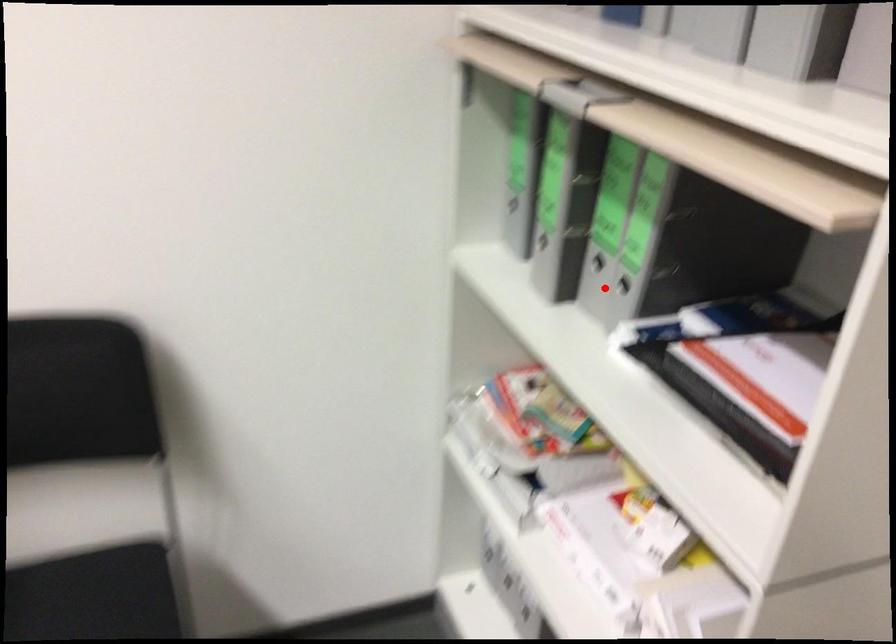
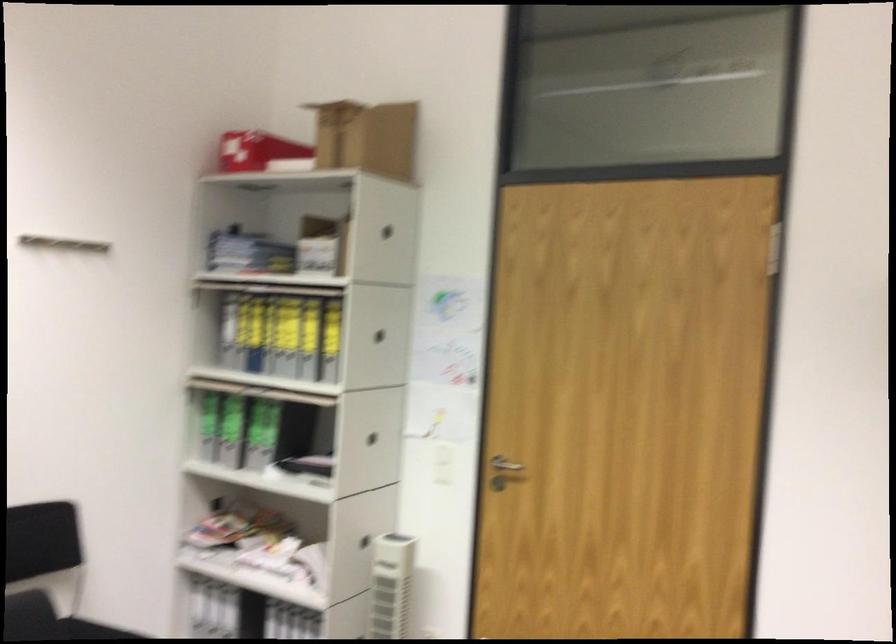
In the second image, find the point that corresponds to the highlighted location in the first image.

(265, 453)